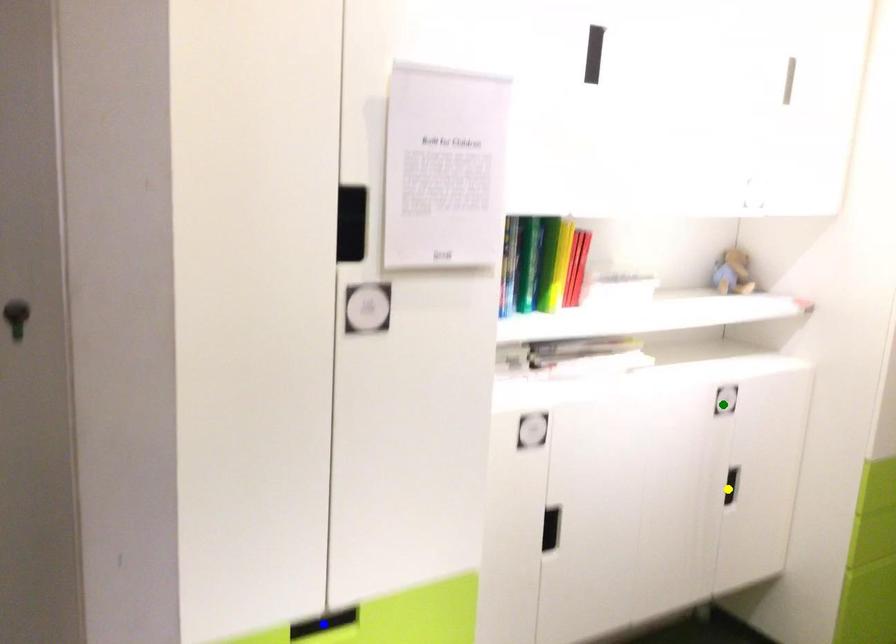
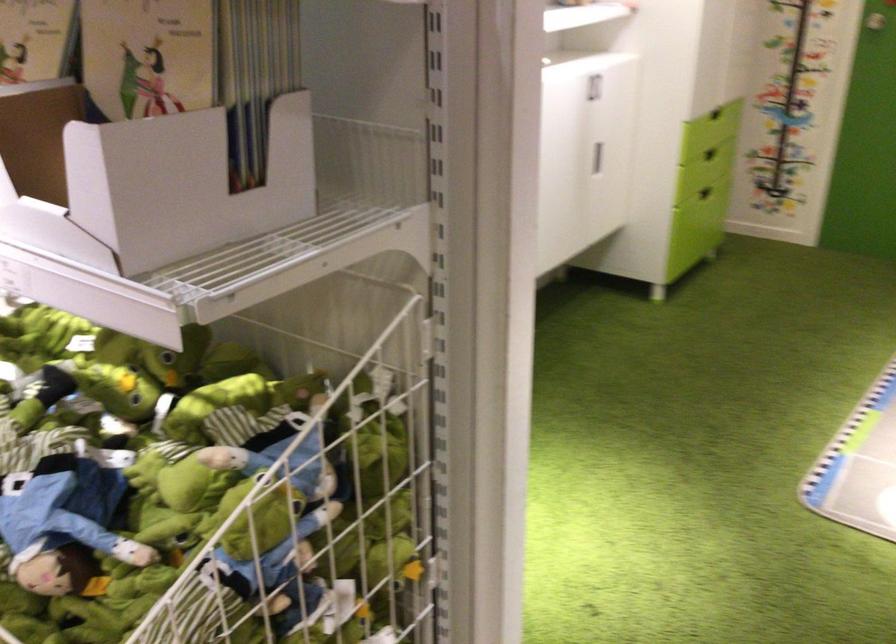
I am providing you with two images of the same scene from different viewpoints. Three points are marked in image1. Which point corresponds to a part or object that is occluded in image2?In image1, three points are marked. Which of them correspond to a part or object that is occluded in image2?Among the three points shown in image1, which one corresponds to a part or object that is no longer visible due to occlusion in image2?

Invisible in image2: blue point.